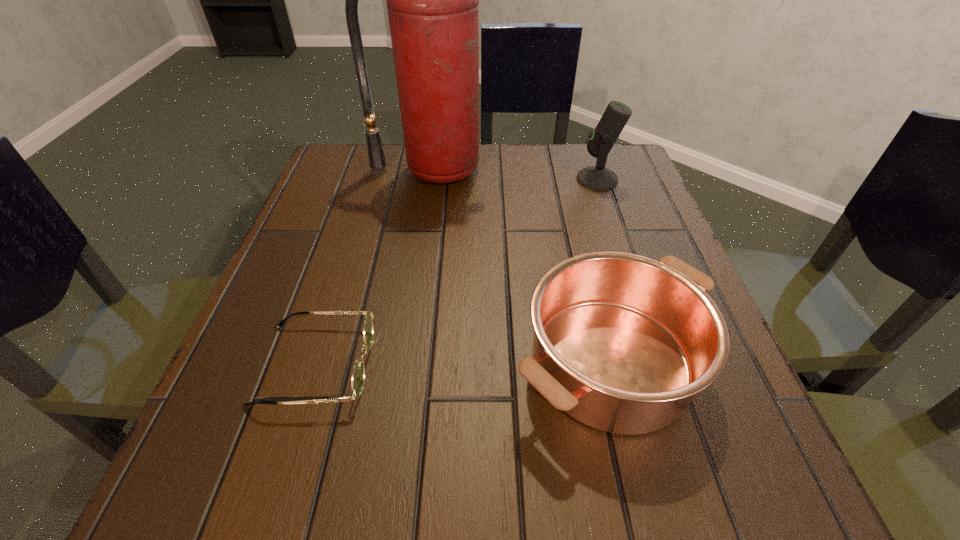
Locate an element on the screen. vacant space that satisfies the following two spatial constraints: 1. at the front of the third tallest object where the nozzle is aimed; 2. on the right side of the tallest object is located at coordinates (403, 362).

In order to click on free spot that satisfies the following two spatial constraints: 1. at the front of the tallest object where the nozzle is aimed; 2. on the left side of the microphone in this screenshot , I will do `click(430, 179)`.